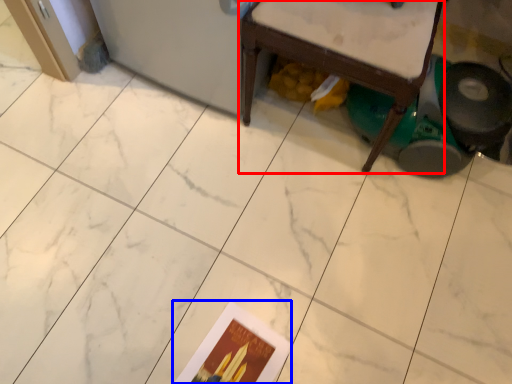
Question: Which object appears farthest to the camera in this image, furniture (highlighted by a red box) or postcard (highlighted by a blue box)?

Choices:
 (A) furniture
 (B) postcard

Answer: (B)